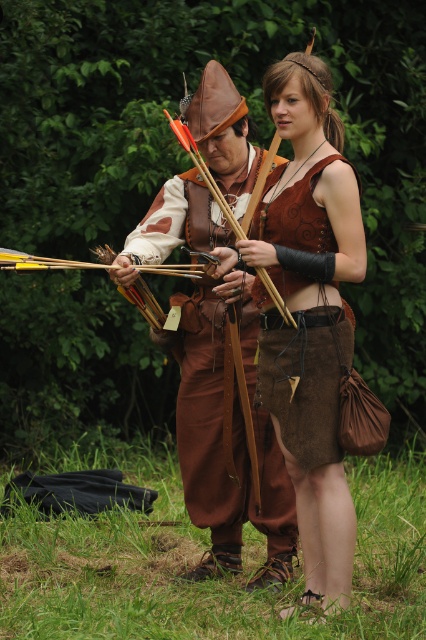
You are an archer in the scene and need to determine which point is closer to you to aim accurately. Which point, point (227, 515) or point (258, 198), is closer to your position?

Point (227, 515) is further to the viewer than point (258, 198), so the closer point to aim at would be point (258, 198).